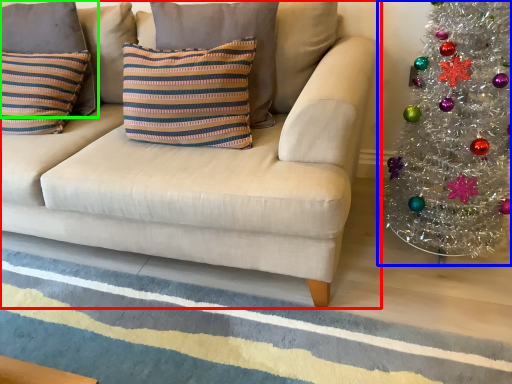
Question: Based on their relative distances, which object is farther from studio couch (highlighted by a red box)? Choose from christmas tree (highlighted by a blue box) and pillow (highlighted by a green box).

Choices:
 (A) christmas tree
 (B) pillow

Answer: (A)